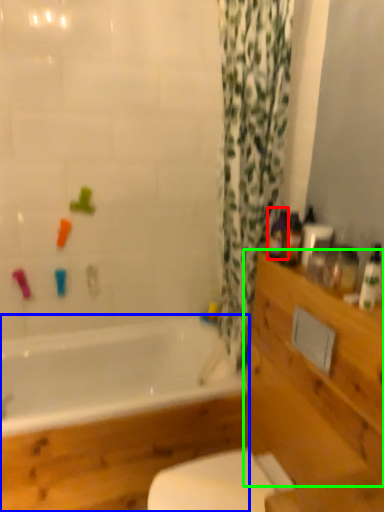
Question: Estimate the real-world distances between objects in this image. Which object is closer to toiletry (highlighted by a red box), bathtub (highlighted by a blue box) or drawer (highlighted by a green box)?

Choices:
 (A) bathtub
 (B) drawer

Answer: (B)